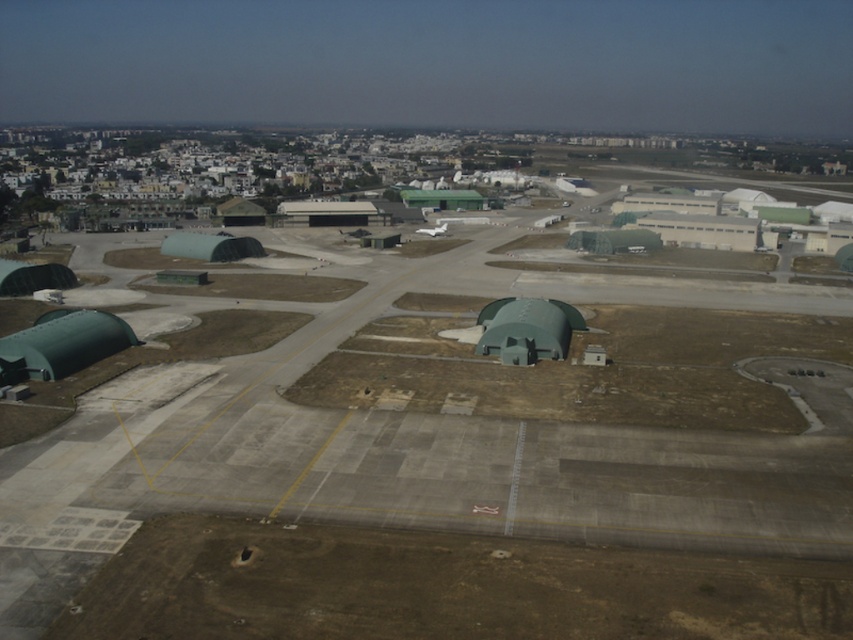
Which of these two, green matte hangar at center or green matte hangar at center-left, stands taller?

green matte hangar at center-left is taller.

Who is positioned more to the right, green matte hangar at center or green matte hangar at center-left?

From the viewer's perspective, green matte hangar at center appears more on the right side.

Is point (503, 337) positioned in front of point (190, 236)?

Yes, it is in front of point (190, 236).

Locate an element on the screen. The height and width of the screenshot is (640, 853). green matte hangar at center is located at coordinates (527, 328).

Does green matte hangar at lower left have a greater width compared to green matte hangar at center?

In fact, green matte hangar at lower left might be narrower than green matte hangar at center.

Is point (96, 330) positioned behind point (558, 333)?

No, (96, 330) is closer to viewer.

Find the location of a particular element. green matte hangar at lower left is located at coordinates (61, 344).

Looking at this image, which of these two, green matte hangar at lower left or green matte hangar at center-left, stands taller?

Standing taller between the two is green matte hangar at center-left.

From the picture: Is green matte hangar at lower left to the right of green matte hangar at center-left from the viewer's perspective?

Correct, you'll find green matte hangar at lower left to the right of green matte hangar at center-left.

Find the location of a particular element. This screenshot has width=853, height=640. green matte hangar at lower left is located at coordinates (61, 344).